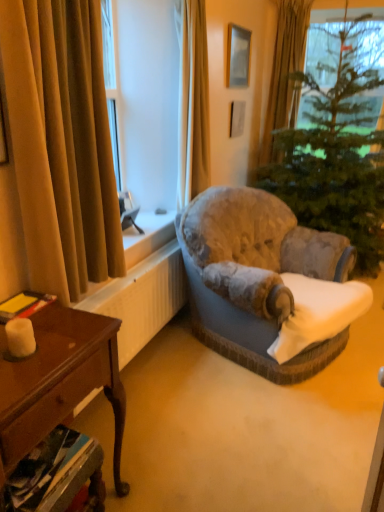
What do you see at coordinates (142, 298) in the screenshot?
I see `white textured radiator at lower left` at bounding box center [142, 298].

Where is `white textured radiator at lower left`? The width and height of the screenshot is (384, 512). white textured radiator at lower left is located at coordinates (142, 298).

The height and width of the screenshot is (512, 384). What do you see at coordinates (20, 337) in the screenshot?
I see `white matte candle at lower left` at bounding box center [20, 337].

What do you see at coordinates (193, 103) in the screenshot? The width and height of the screenshot is (384, 512). I see `velvet beige curtain at upper center, the second curtain when ordered from right to left` at bounding box center [193, 103].

Based on the photo, in order to face velvet beige curtain at upper center, the second curtain viewed from the left, should I rotate leftwards or rightwards?

Turn right approximately 0.710 degrees to face it.

What is the approximate height of gold velvet curtain at upper right, which ranks as the first curtain in back-to-front order?

gold velvet curtain at upper right, which ranks as the first curtain in back-to-front order, is 5.58 feet in height.

Where is `white textured radiator at lower left`? The height and width of the screenshot is (512, 384). white textured radiator at lower left is located at coordinates (142, 298).

Could you tell me if velvet gold curtain at left, which appears as the third curtain when viewed from the right, is turned towards wooden desk at lower left?

No, velvet gold curtain at left, which appears as the third curtain when viewed from the right, is not facing towards wooden desk at lower left.

Where is `curtain that is the 1st one when counting backward from the wooden desk at lower left`? curtain that is the 1st one when counting backward from the wooden desk at lower left is located at coordinates [x=61, y=143].

How many degrees apart are the facing directions of velvet gold curtain at left, which ranks as the 1th curtain in left-to-right order, and wooden desk at lower left?

The angle between the facing direction of velvet gold curtain at left, which ranks as the 1th curtain in left-to-right order, and the facing direction of wooden desk at lower left is 4.58 degrees.

In terms of width, does velvet gold curtain at left, which appears as the third curtain when viewed from the right, look wider or thinner when compared to wooden desk at lower left?

In the image, velvet gold curtain at left, which appears as the third curtain when viewed from the right, appears to be more narrow than wooden desk at lower left.

Can you confirm if velvet grey armchair at center is bigger than velvet beige curtain at upper center, the second curtain viewed from the left?

Yes, velvet grey armchair at center is bigger than velvet beige curtain at upper center, the second curtain viewed from the left.

Considering the sizes of objects velvet grey armchair at center and velvet beige curtain at upper center, the second curtain viewed from the left, in the image provided, who is taller, velvet grey armchair at center or velvet beige curtain at upper center, the second curtain viewed from the left,?

Standing taller between the two is velvet beige curtain at upper center, the second curtain viewed from the left.

From the image's perspective, is velvet grey armchair at center under velvet beige curtain at upper center, the second curtain viewed from the left?

Yes.

Consider the image. Looking at their sizes, would you say matte silver picture frame at upper center is wider or thinner than velvet grey armchair at center?

matte silver picture frame at upper center is thinner than velvet grey armchair at center.

How far apart are matte silver picture frame at upper center and velvet grey armchair at center?

matte silver picture frame at upper center is 1.67 meters away from velvet grey armchair at center.

Considering their positions, is matte silver picture frame at upper center located in front of or behind velvet grey armchair at center?

In the image, matte silver picture frame at upper center appears behind velvet grey armchair at center.

Is matte silver picture frame at upper center next to velvet grey armchair at center and touching it?

There is a gap between matte silver picture frame at upper center and velvet grey armchair at center.

Which point is more distant from viewer, [335,152] or [232,288]?

Positioned behind is point [335,152].

In the image, there is a green textured christmas tree at center. Where is `chair below it (from a real-world perspective)`? This screenshot has height=512, width=384. chair below it (from a real-world perspective) is located at coordinates (255, 277).

Is green textured christmas tree at center inside the boundaries of velvet grey armchair at center, or outside?

green textured christmas tree at center is not inside velvet grey armchair at center, it's outside.

Which of these two, matte silver picture frame at upper center or velvet gold curtain at left, arranged as the 1th curtain when viewed from the front, is bigger?

Bigger between the two is velvet gold curtain at left, arranged as the 1th curtain when viewed from the front.

Considering the relative sizes of matte silver picture frame at upper center and velvet gold curtain at left, placed as the 3th curtain when sorted from back to front, in the image provided, is matte silver picture frame at upper center wider than velvet gold curtain at left, placed as the 3th curtain when sorted from back to front,?

No, matte silver picture frame at upper center is not wider than velvet gold curtain at left, placed as the 3th curtain when sorted from back to front.

Which is correct: matte silver picture frame at upper center is inside velvet gold curtain at left, which ranks as the 1th curtain in left-to-right order, or outside of it?

matte silver picture frame at upper center is outside velvet gold curtain at left, which ranks as the 1th curtain in left-to-right order.

Which of these two, matte silver picture frame at upper center or velvet gold curtain at left, arranged as the 1th curtain when viewed from the front, stands shorter?

matte silver picture frame at upper center.

Between velvet beige curtain at upper center, marked as the 2th curtain in a front-to-back arrangement, and gold velvet curtain at upper right, which is the third curtain from left to right, which one has smaller width?

velvet beige curtain at upper center, marked as the 2th curtain in a front-to-back arrangement.

Is velvet beige curtain at upper center, the second curtain viewed from the back, touching gold velvet curtain at upper right, which is the third curtain from front to back?

No, velvet beige curtain at upper center, the second curtain viewed from the back, is not beside gold velvet curtain at upper right, which is the third curtain from front to back.

Between point (184, 152) and point (283, 85), which one is positioned in front?

The point (184, 152) is closer.

Is matte silver picture frame at upper center looking in the opposite direction of white textured radiator at lower left?

No.

Is matte silver picture frame at upper center with white textured radiator at lower left?

No, matte silver picture frame at upper center is not in contact with white textured radiator at lower left.

From the image's perspective, which object appears higher, matte silver picture frame at upper center or white textured radiator at lower left?

matte silver picture frame at upper center.

Is point (233, 82) farther from viewer compared to point (155, 287)?

Yes, it is.

Locate an element on the screen. the 1st curtain positioned above the wooden desk at lower left (from the image's perspective) is located at coordinates (61, 143).

The width and height of the screenshot is (384, 512). I want to click on the 2nd curtain directly above the velvet grey armchair at center (from a real-world perspective), so [193, 103].

From the image, which object appears to be nearer to wooden desk at lower left, velvet grey armchair at center or white matte candle at lower left?

Based on the image, white matte candle at lower left appears to be nearer to wooden desk at lower left.

When comparing their distances from white textured radiator at lower left, does white matte candle at lower left or gold velvet curtain at upper right, which is the 1th curtain from right to left, seem further?

gold velvet curtain at upper right, which is the 1th curtain from right to left, is positioned further to the anchor white textured radiator at lower left.

Based on their spatial positions, is gold velvet curtain at upper right, which is the third curtain from front to back, or white matte candle at lower left closer to velvet gold curtain at left, which appears as the third curtain when viewed from the right?

white matte candle at lower left.

Considering their positions, is wooden desk at lower left positioned closer to matte silver picture frame at upper center than velvet gold curtain at left, arranged as the 1th curtain when viewed from the front?

velvet gold curtain at left, arranged as the 1th curtain when viewed from the front.

From the image, which object appears to be farther from velvet grey armchair at center, white textured radiator at lower left or velvet beige curtain at upper center, the second curtain when ordered from right to left?

velvet beige curtain at upper center, the second curtain when ordered from right to left, is positioned further to the anchor velvet grey armchair at center.

When comparing their distances from white textured radiator at lower left, does wooden desk at lower left or gold velvet curtain at upper right, which is the third curtain from front to back, seem further?

gold velvet curtain at upper right, which is the third curtain from front to back.

Which object lies nearer to the anchor point matte silver picture frame at upper center, gold velvet curtain at upper right, which ranks as the first curtain in back-to-front order, or white matte candle at lower left?

gold velvet curtain at upper right, which ranks as the first curtain in back-to-front order.

Based on their spatial positions, is white textured radiator at lower left or velvet beige curtain at upper center, the second curtain viewed from the left, further from velvet gold curtain at left, which ranks as the 1th curtain in left-to-right order?

Among the two, velvet beige curtain at upper center, the second curtain viewed from the left, is located further to velvet gold curtain at left, which ranks as the 1th curtain in left-to-right order.

Locate an element on the screen. chair between velvet beige curtain at upper center, the second curtain viewed from the left, and wooden desk at lower left vertically is located at coordinates (255, 277).

Identify the location of christmas tree between matte silver picture frame at upper center and wooden desk at lower left in the up-down direction. This screenshot has height=512, width=384. (332, 160).

Locate an element on the screen. radiator positioned between velvet gold curtain at left, which appears as the third curtain when viewed from the right, and matte silver picture frame at upper center from near to far is located at coordinates (142, 298).

The height and width of the screenshot is (512, 384). In order to click on radiator located between velvet gold curtain at left, arranged as the 1th curtain when viewed from the front, and velvet grey armchair at center in the left-right direction in this screenshot , I will do `click(142, 298)`.